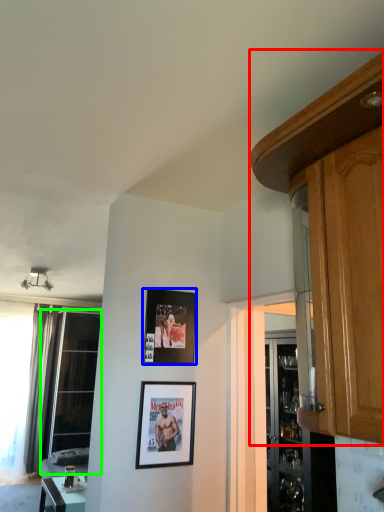
Question: Based on their relative distances, which object is nearer to cabinetry (highlighted by a red box)? Choose from picture frame (highlighted by a blue box) and window (highlighted by a green box).

Choices:
 (A) picture frame
 (B) window

Answer: (A)